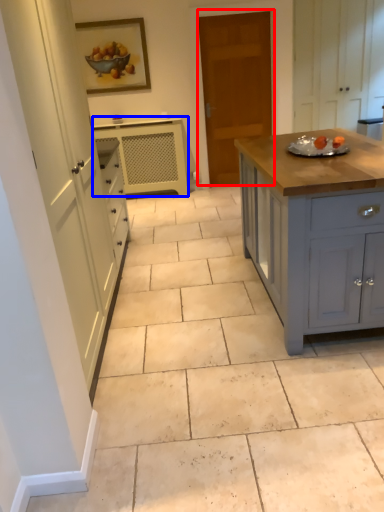
Question: Which object appears closest to the camera in this image, door (highlighted by a red box) or cabinetry (highlighted by a blue box)?

Choices:
 (A) door
 (B) cabinetry

Answer: (A)